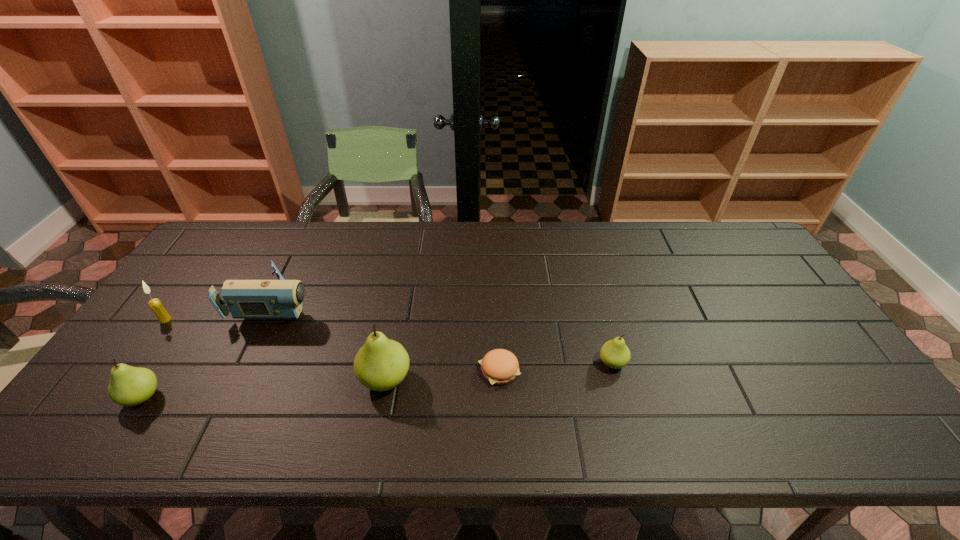
Considering the uniform spacing of pears, where should an additional pear be positioned on the right? Please locate a free spot. Please provide its 2D coordinates. Your answer should be formatted as a tuple, i.e. [(x, y)], where the tuple contains the x and y coordinates of a point satisfying the conditions above.

[(825, 348)]